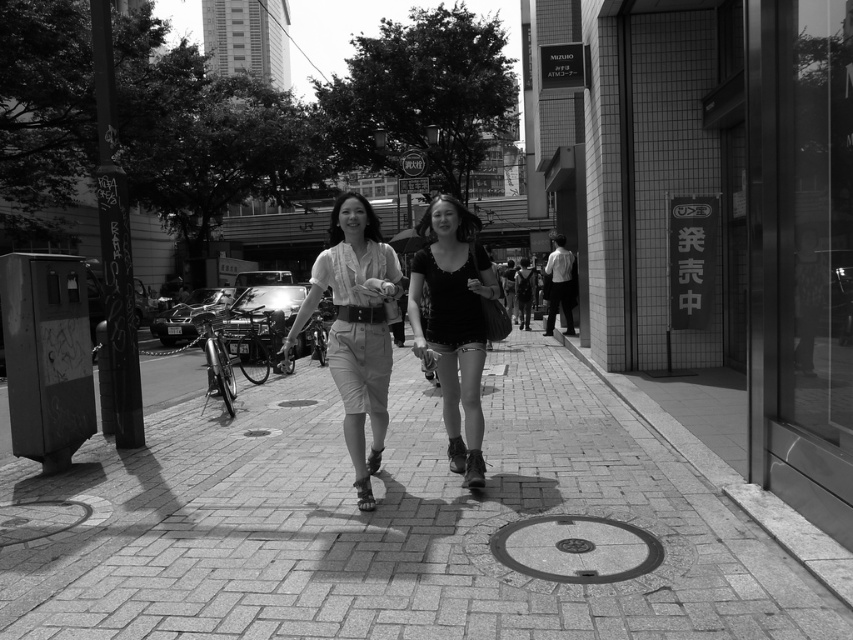
Question: Does brick pavement at center have a smaller size compared to matte white blouse at center?

Choices:
 (A) no
 (B) yes

Answer: (B)

Question: Which point is closer to the camera?

Choices:
 (A) (340, 529)
 (B) (369, 420)
 (C) (485, 353)

Answer: (A)

Question: Can you confirm if brick pavement at center is positioned to the left of matte black shirt at center?

Choices:
 (A) no
 (B) yes

Answer: (B)

Question: Based on their relative distances, which object is farther from the matte white blouse at center?

Choices:
 (A) brick pavement at center
 (B) matte black shirt at center

Answer: (A)

Question: Observing the image, what is the correct spatial positioning of brick pavement at center in reference to matte black shirt at center?

Choices:
 (A) left
 (B) right

Answer: (A)

Question: Which object appears farthest from the camera in this image?

Choices:
 (A) matte black shirt at center
 (B) matte white blouse at center
 (C) brick pavement at center

Answer: (C)